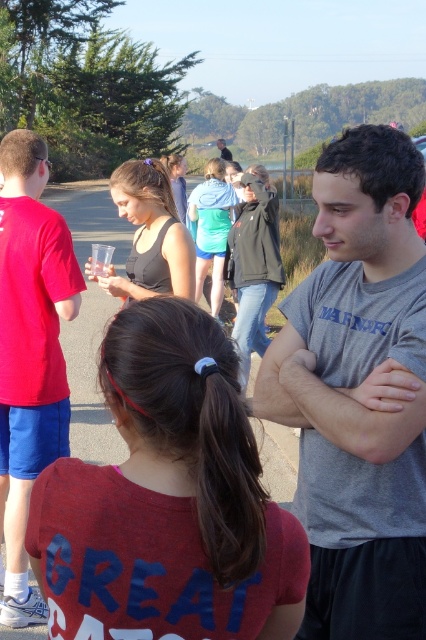
Question: Is matte red t-shirt at left closer to camera compared to matte black jacket at center?

Choices:
 (A) yes
 (B) no

Answer: (A)

Question: Can you confirm if matte red t-shirt at left is positioned below matte black jacket at center?

Choices:
 (A) no
 (B) yes

Answer: (B)

Question: Does gray cotton t-shirt at center appear on the left side of matte black jacket at center?

Choices:
 (A) no
 (B) yes

Answer: (B)

Question: Which of the following is the closest to the observer?

Choices:
 (A) matte black jacket at center
 (B) matte red t-shirt at left
 (C) gray cotton t-shirt at center

Answer: (C)

Question: Which point is farther to the camera?

Choices:
 (A) (313, 460)
 (B) (218, 148)
 (C) (66, 284)

Answer: (B)

Question: Which point is farther from the camera taking this photo?

Choices:
 (A) (400, 324)
 (B) (8, 568)

Answer: (B)